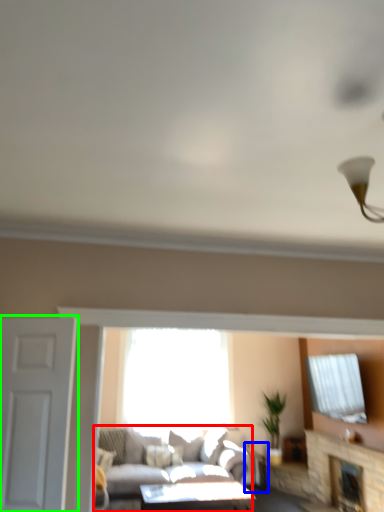
Question: Which object is positioned closest to studio couch (highlighted by a red box)? Select from side table (highlighted by a blue box) and door (highlighted by a green box).

Choices:
 (A) side table
 (B) door

Answer: (A)